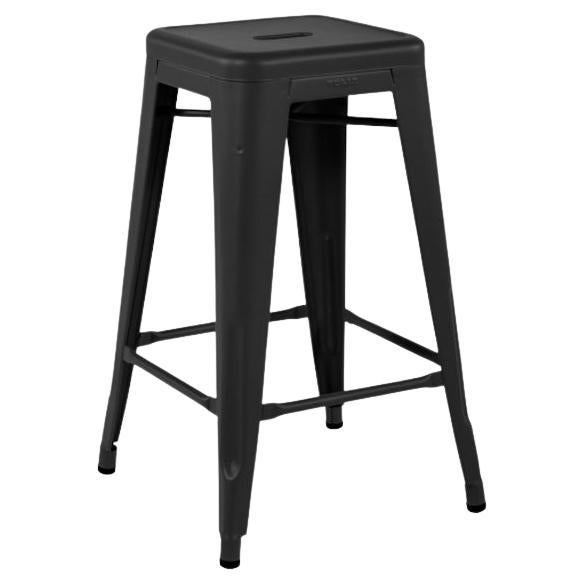
What are the coordinates of `black seat` in the screenshot? It's located at (229, 37).